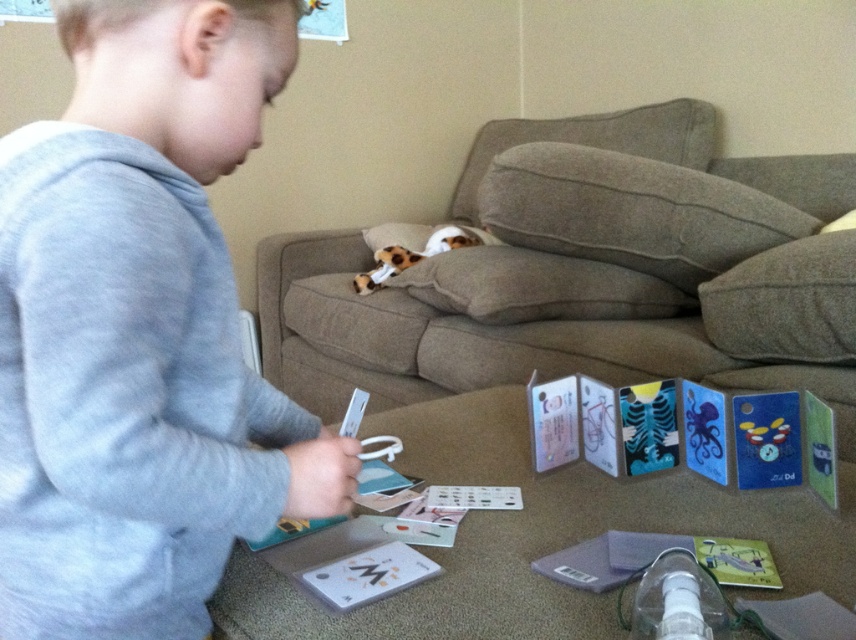
Question: Which point is farther to the camera?

Choices:
 (A) white matte card at lower center
 (B) brown fabric couch at center
 (C) cheetah-print plush at center

Answer: (C)

Question: Does brown fabric couch at center have a lesser width compared to white matte cards at center?

Choices:
 (A) no
 (B) yes

Answer: (A)

Question: Which of the following is the closest to the observer?

Choices:
 (A) (381, 596)
 (B) (444, 376)
 (C) (165, 472)
 (D) (468, 500)

Answer: (C)

Question: Does white matte card at lower center appear under white matte cards at center?

Choices:
 (A) no
 (B) yes

Answer: (B)

Question: Which point is closer to the camera?

Choices:
 (A) (274, 240)
 (B) (446, 493)

Answer: (B)

Question: Is gray cotton shirt at upper left further to the viewer compared to brown fabric couch at center?

Choices:
 (A) yes
 (B) no

Answer: (B)